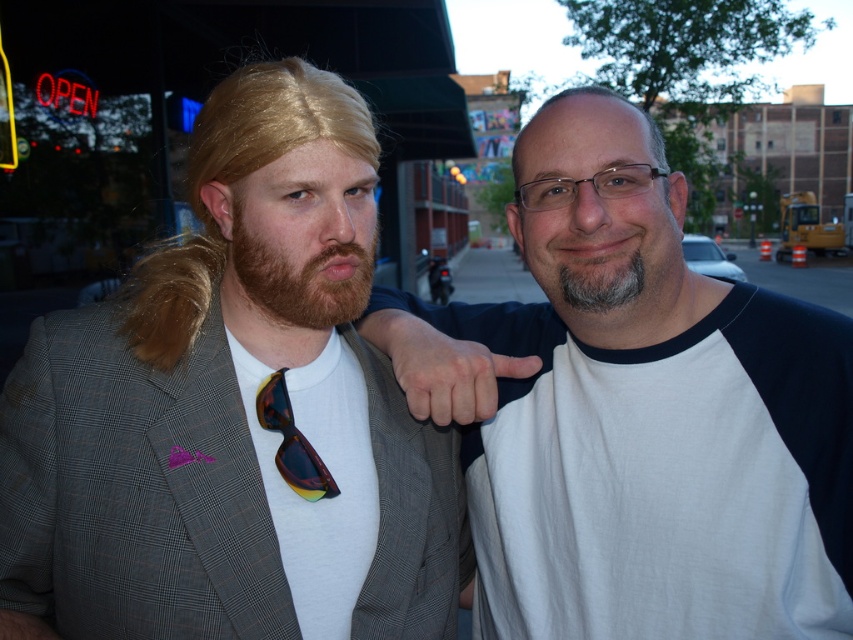
You are standing in an urban area and see two points marked in the image. Which point is closer to you, point (352,166) or point (259,224)?

Point (352,166) is further to the viewer than point (259,224), so point (259,224) is closer to you.